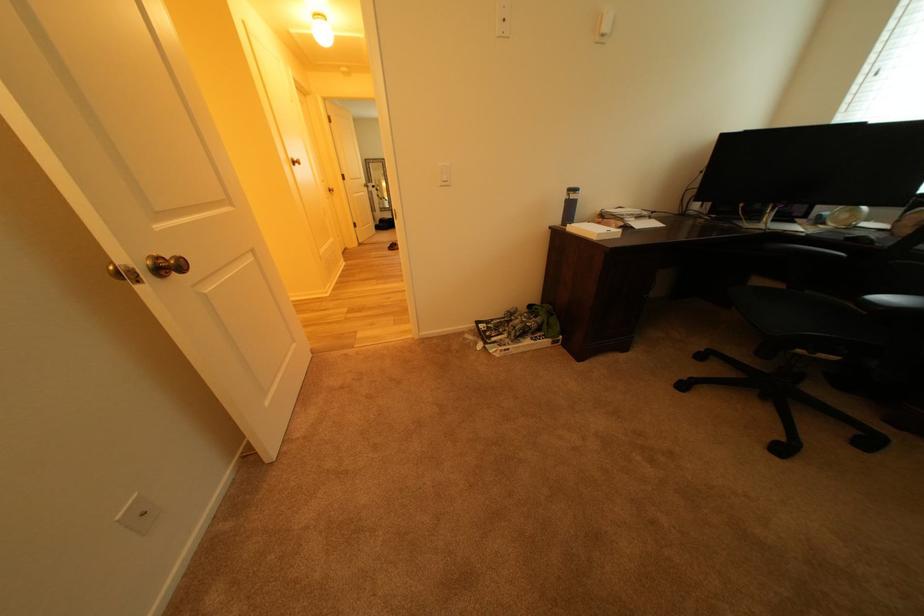
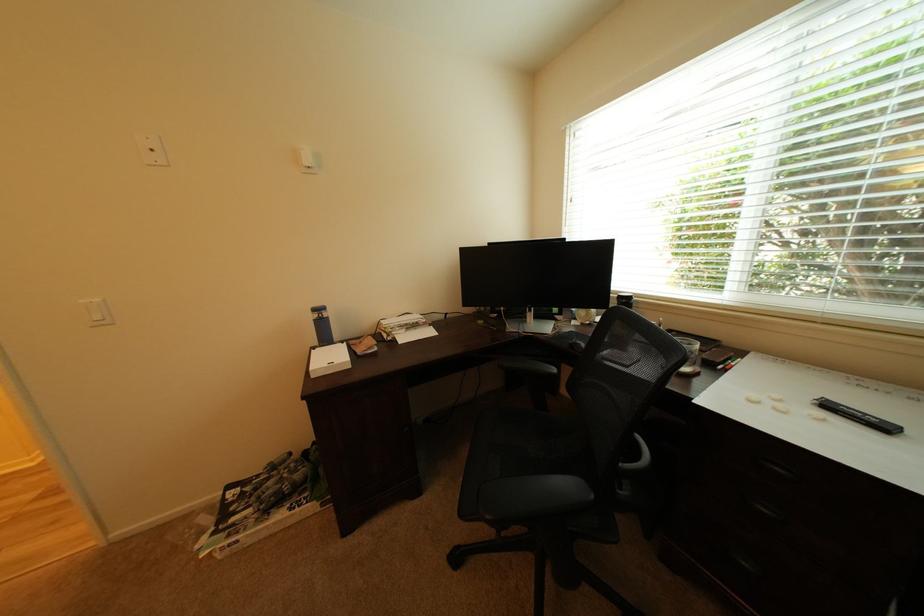
In the second image, find the point that corresponds to (857,238) in the first image.

(580, 345)